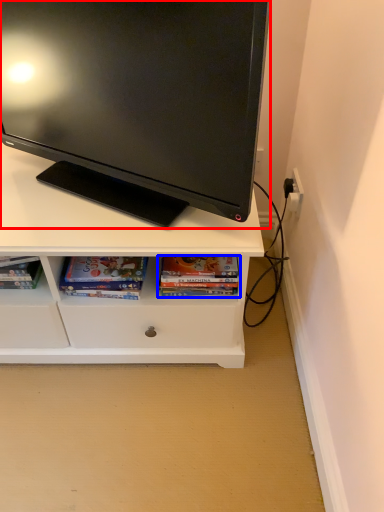
Question: Which point is further to the camera, television (highlighted by a red box) or book (highlighted by a blue box)?

Choices:
 (A) television
 (B) book

Answer: (B)